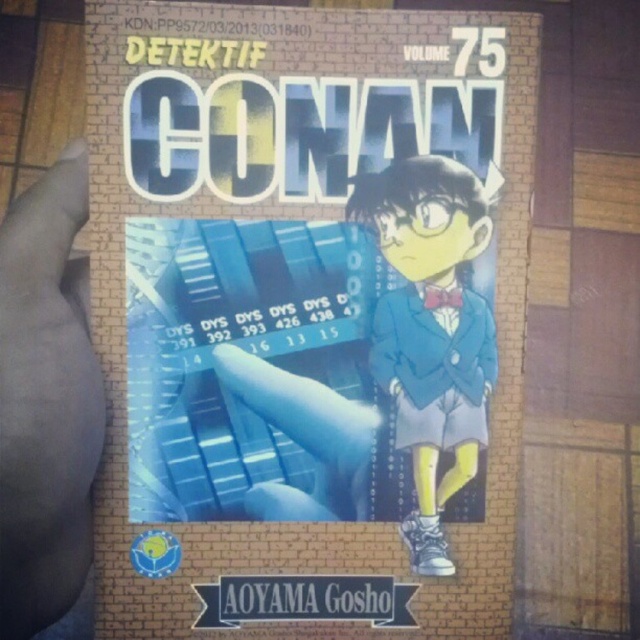
Question: Considering the real-world distances, which object is closest to the dark skin at left?

Choices:
 (A) matte blue suit at center
 (B) matte blue book at center

Answer: (B)

Question: Among these points, which one is farthest from the camera?

Choices:
 (A) (429, 275)
 (B) (49, 259)
 (C) (364, 625)

Answer: (C)

Question: Can you confirm if matte blue book at center is positioned above matte blue suit at center?

Choices:
 (A) yes
 (B) no

Answer: (A)

Question: Which point is farther to the camera?

Choices:
 (A) dark skin at left
 (B) matte blue suit at center

Answer: (B)

Question: Does dark skin at left come in front of matte blue suit at center?

Choices:
 (A) no
 (B) yes

Answer: (B)

Question: Can you confirm if matte blue book at center is bigger than dark skin at left?

Choices:
 (A) yes
 (B) no

Answer: (A)